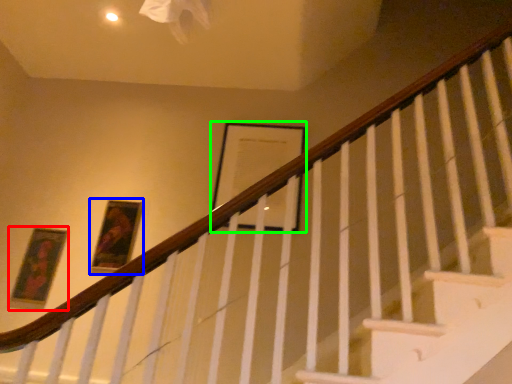
Question: Which is farther away from picture frame (highlighted by a red box)? picture frame (highlighted by a blue box) or picture frame (highlighted by a green box)?

Choices:
 (A) picture frame
 (B) picture frame

Answer: (B)